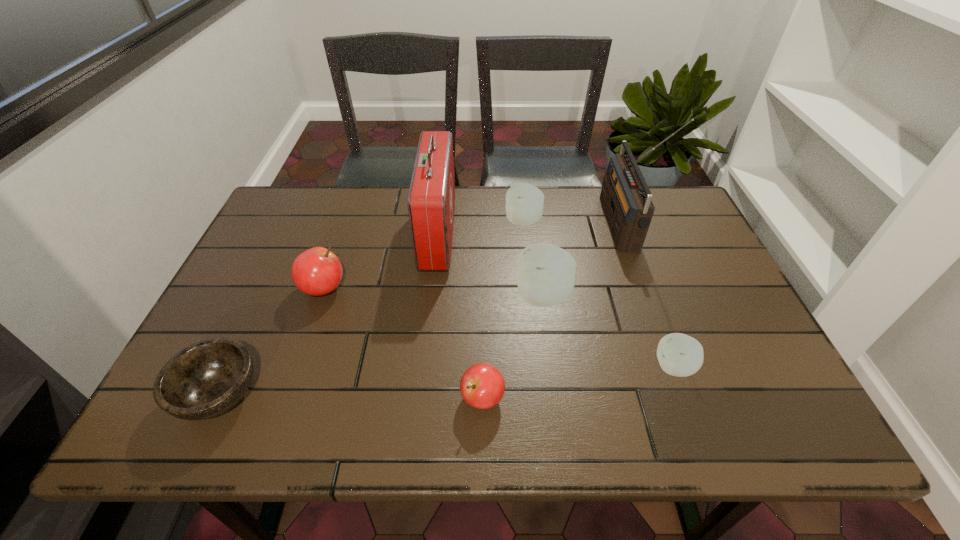
This screenshot has width=960, height=540. What are the coordinates of `the nearest white apple` in the screenshot? It's located at (680, 355).

Find the location of a particular element. the second apple from left to right is located at coordinates (482, 386).

The height and width of the screenshot is (540, 960). I want to click on the nearer red apple, so click(x=482, y=386).

Where is `bowl`? The width and height of the screenshot is (960, 540). bowl is located at coordinates (206, 379).

This screenshot has width=960, height=540. I want to click on free location located 0.320m on the front-facing side of the radio receiver, so click(x=500, y=226).

Locate an element on the screen. Image resolution: width=960 pixels, height=540 pixels. vacant area situated on the front-facing side of the radio receiver is located at coordinates (507, 226).

What are the coordinates of `free region located 0.360m on the front-facing side of the radio receiver` in the screenshot? It's located at (488, 226).

What are the coordinates of `free space located 0.230m on the side of the red first-aid kit with the first aid cross symbol` in the screenshot? It's located at (532, 234).

Where is `blank area located 0.060m on the front of the third tallest object`? The image size is (960, 540). blank area located 0.060m on the front of the third tallest object is located at coordinates (548, 339).

Identify the location of free space located 0.220m on the front of the second biggest white apple. (531, 288).